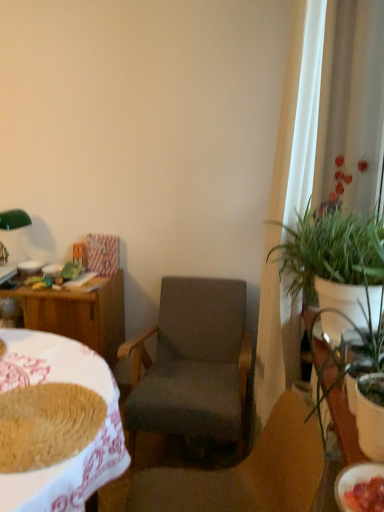
Question: Which direction should I rotate to face dark gray fabric chair at center, which ranks as the 1th chair in front-to-back order, — up or down?

Choices:
 (A) down
 (B) up

Answer: (A)

Question: Is wooden desk at left smaller than white sheer curtain at right?

Choices:
 (A) yes
 (B) no

Answer: (A)

Question: Considering the relative sizes of wooden desk at left and white sheer curtain at right in the image provided, is wooden desk at left thinner than white sheer curtain at right?

Choices:
 (A) no
 (B) yes

Answer: (A)

Question: Does wooden desk at left touch white sheer curtain at right?

Choices:
 (A) yes
 (B) no

Answer: (B)

Question: From a real-world perspective, does wooden desk at left sit lower than white sheer curtain at right?

Choices:
 (A) no
 (B) yes

Answer: (B)

Question: Is wooden desk at left behind white sheer curtain at right?

Choices:
 (A) yes
 (B) no

Answer: (B)

Question: Is wooden desk at left positioned far away from white sheer curtain at right?

Choices:
 (A) no
 (B) yes

Answer: (B)

Question: Is baked brown bread at lower left oriented away from wooden table at left, the second table positioned from the front?

Choices:
 (A) yes
 (B) no

Answer: (B)

Question: Is baked brown bread at lower left further to the viewer compared to wooden table at left, acting as the 1th table starting from the left?

Choices:
 (A) no
 (B) yes

Answer: (A)

Question: Does baked brown bread at lower left turn towards wooden table at left, arranged as the second table when viewed from the right?

Choices:
 (A) yes
 (B) no

Answer: (B)

Question: Considering the relative sizes of baked brown bread at lower left and wooden table at left, acting as the 1th table starting from the left, in the image provided, is baked brown bread at lower left wider than wooden table at left, acting as the 1th table starting from the left,?

Choices:
 (A) no
 (B) yes

Answer: (A)

Question: Is there a large distance between baked brown bread at lower left and wooden table at left, arranged as the second table when viewed from the right?

Choices:
 (A) yes
 (B) no

Answer: (A)

Question: Can you confirm if baked brown bread at lower left is positioned to the left of wooden table at left, arranged as the second table when viewed from the right?

Choices:
 (A) no
 (B) yes

Answer: (A)

Question: Is dark gray fabric chair at center, which ranks as the 2th chair in front-to-back order, in contact with matte white bowl at lower right, the first bowl ordered from the bottom?

Choices:
 (A) no
 (B) yes

Answer: (A)